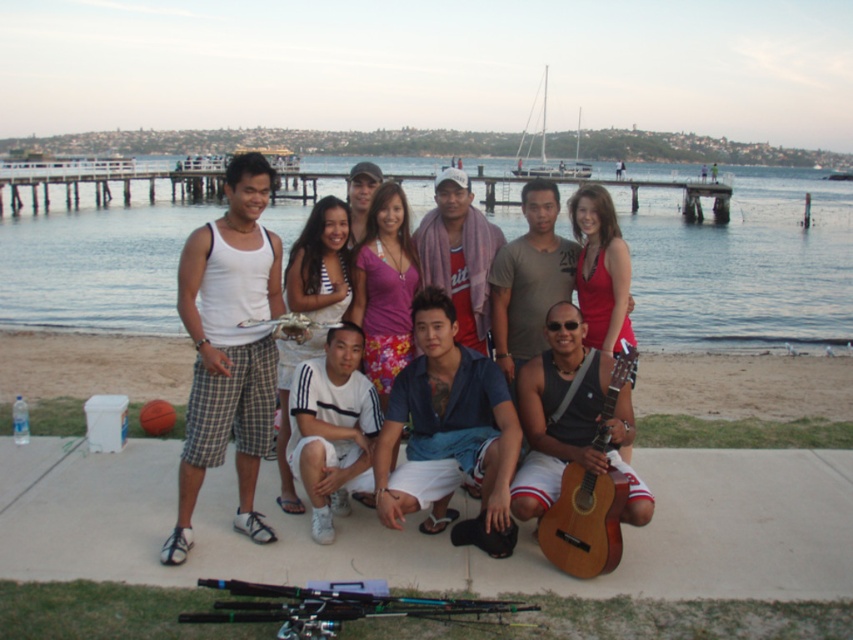
Does white tank top at center come behind beige sand at lower center?

No, white tank top at center is in front of beige sand at lower center.

The width and height of the screenshot is (853, 640). I want to click on white tank top at center, so click(495, 264).

Find the location of a particular element. Image resolution: width=853 pixels, height=640 pixels. white tank top at center is located at coordinates (495, 264).

Between clear blue water at upper center and white tank top at center, which one has more height?

Standing taller between the two is clear blue water at upper center.

Is clear blue water at upper center above white tank top at center?

Yes, clear blue water at upper center is above white tank top at center.

Between point (106, 289) and point (194, 248), which one is positioned behind?

Point (106, 289)

Find the location of a particular element. The width and height of the screenshot is (853, 640). clear blue water at upper center is located at coordinates (743, 264).

Is white cotton tank top at left above beige sand at lower center?

Yes.

Measure the distance between point (210, 248) and camera.

They are 6.12 meters apart.

Where is `white cotton tank top at left`? This screenshot has height=640, width=853. white cotton tank top at left is located at coordinates (229, 348).